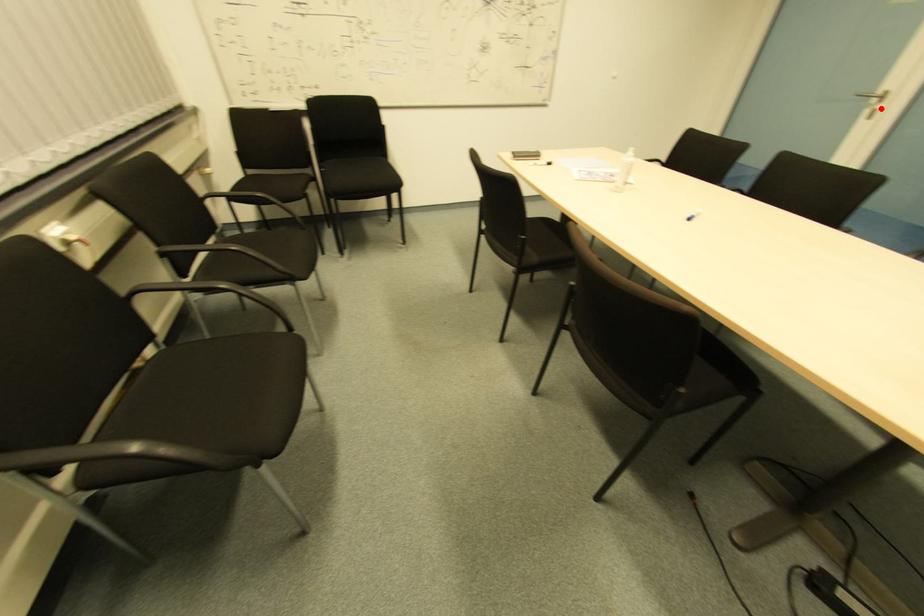
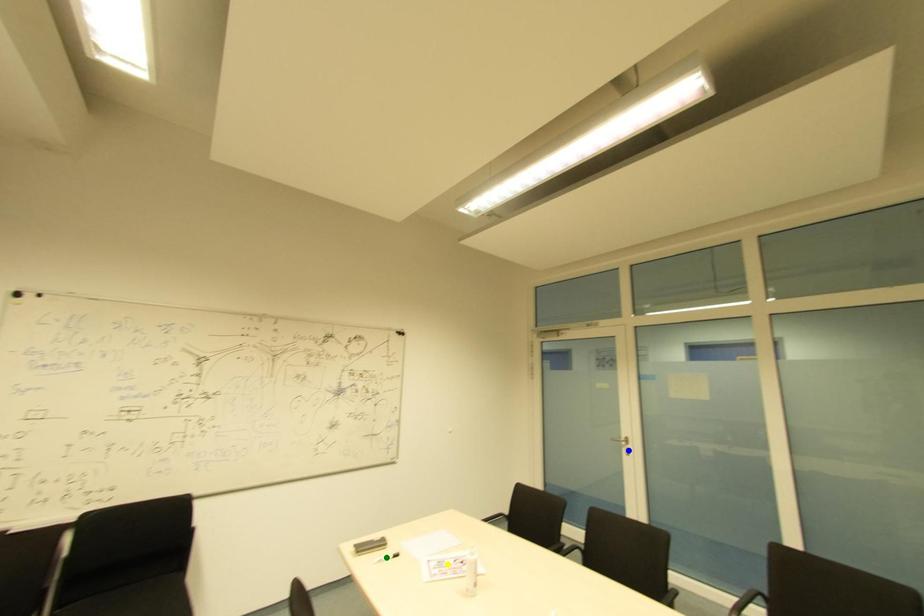
Question: I am providing you with two images of the same scene from different viewpoints. A red point is marked on the first image. You are given multiple points on the second image. Which point in image 2 is actually the same real-world point as the red point in image 1?

Choices:
 (A) green point
 (B) yellow point
 (C) blue point

Answer: (C)